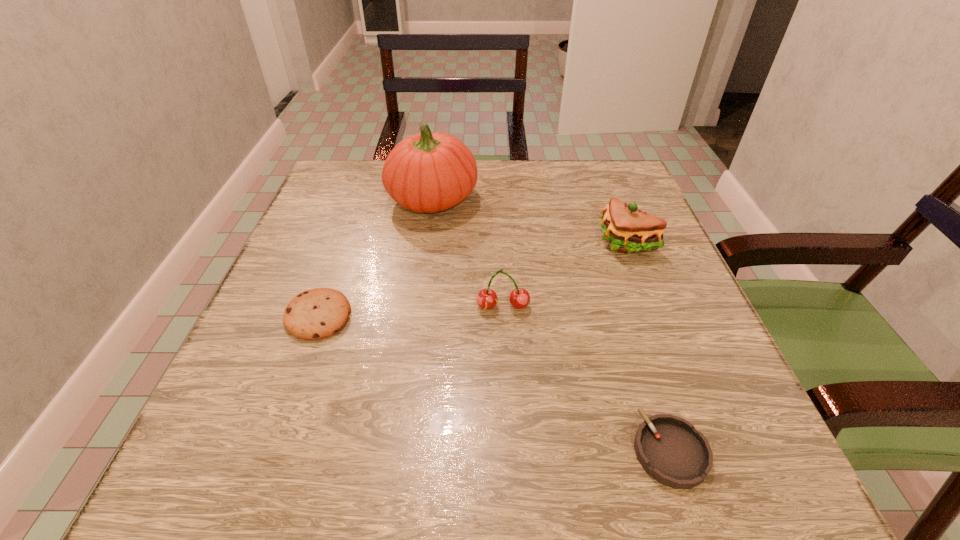
Locate an element on the screen. The image size is (960, 540). vacant region between the leftmost object and the sandwich is located at coordinates (472, 279).

Image resolution: width=960 pixels, height=540 pixels. In order to click on free spot between the cookie and the sandwich in this screenshot , I will do `click(472, 279)`.

This screenshot has width=960, height=540. I want to click on free point between the cherry and the ashtray, so (x=587, y=379).

Identify which object is the second closest to the ashtray. Please provide its 2D coordinates. Your answer should be formatted as a tuple, i.e. [(x, y)], where the tuple contains the x and y coordinates of a point satisfying the conditions above.

[(627, 229)]

Choose which object is the second nearest neighbor to the third shortest object. Please provide its 2D coordinates. Your answer should be formatted as a tuple, i.e. [(x, y)], where the tuple contains the x and y coordinates of a point satisfying the conditions above.

[(318, 313)]

Locate an element on the screen. The image size is (960, 540). vacant space that satisfies the following two spatial constraints: 1. on the front side of the pumpkin; 2. on the right side of the second tallest object is located at coordinates [426, 242].

Locate an element on the screen. The image size is (960, 540). free space that satisfies the following two spatial constraints: 1. with stems pointing upwards on the ashtray; 2. on the right side of the third shortest object is located at coordinates (511, 450).

Find the location of `vacant space that satisfies the following two spatial constraints: 1. on the back side of the nearest object; 2. on the left side of the sandwich`. vacant space that satisfies the following two spatial constraints: 1. on the back side of the nearest object; 2. on the left side of the sandwich is located at coordinates (603, 242).

Where is `free spot that satisfies the following two spatial constraints: 1. on the back side of the leftmost object; 2. on the left side of the sandwich`? free spot that satisfies the following two spatial constraints: 1. on the back side of the leftmost object; 2. on the left side of the sandwich is located at coordinates (345, 242).

The width and height of the screenshot is (960, 540). Identify the location of free space that satisfies the following two spatial constraints: 1. with stems pointing upwards on the cherry; 2. on the left side of the ashtray. (511, 450).